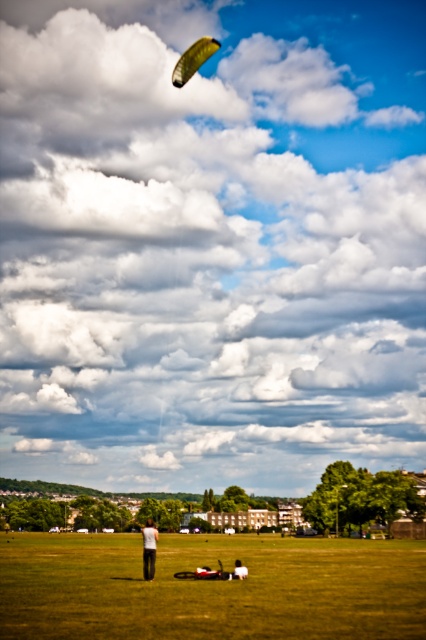
You are planning to set up a picnic blanket between the green grass at center and the green fabric parachute at upper center. Given that the picnic blanket requires 150 feet of space to unfold properly, will there be enough space between them?

The distance between the green grass at center and the green fabric parachute at upper center is 190.28 feet, which is more than the required 150 feet. Therefore, there is sufficient space to set up the picnic blanket.

You are a fashion designer analyzing the clothing in the scene. The person is wearing a white cotton shirt at center and dark gray pants at center. Which piece of clothing appears to be bigger?

The white cotton shirt at center has a larger size compared to dark gray pants at center, so the white cotton shirt at center is bigger.